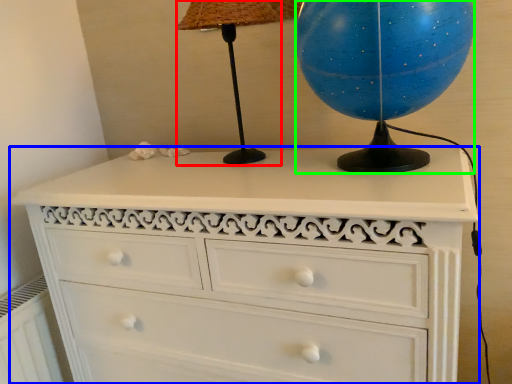
Question: Estimate the real-world distances between objects in this image. Which object is closer to table lamp (highlighted by a red box), chest of drawers (highlighted by a blue box) or sphere (highlighted by a green box)?

Choices:
 (A) chest of drawers
 (B) sphere

Answer: (B)